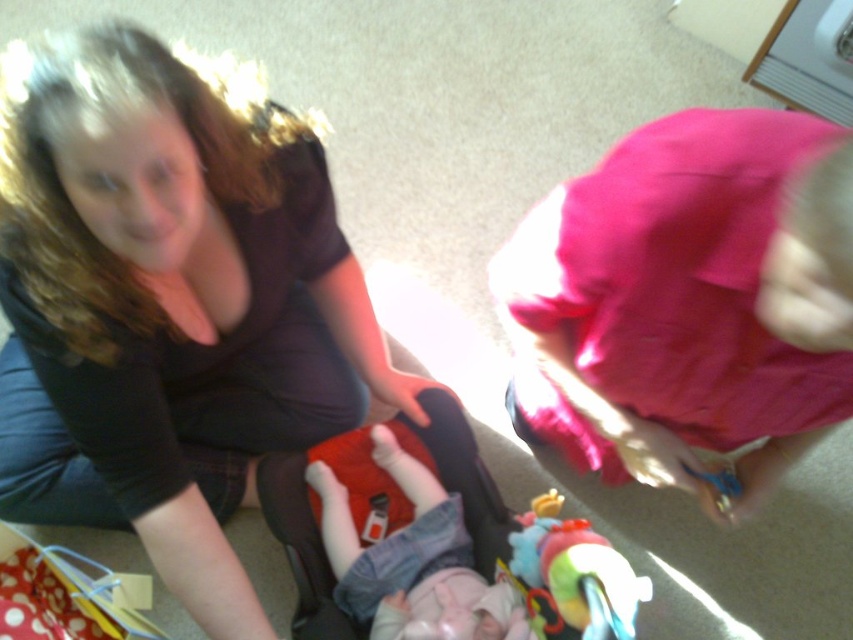
Who is more distant from viewer, (13, 492) or (587, 355)?

Point (13, 492)

Is point (318, 140) farther from camera compared to point (726, 163)?

Yes.

Does point (206, 582) come farther from viewer compared to point (704, 502)?

No, (206, 582) is in front of (704, 502).

The image size is (853, 640). I want to click on matte black shirt at center, so click(x=167, y=301).

Looking at this image, which of these two, denim pants at center or rubberized plastic toy at lower center, stands shorter?

rubberized plastic toy at lower center

In the scene shown: Can you confirm if denim pants at center is shorter than rubberized plastic toy at lower center?

In fact, denim pants at center may be taller than rubberized plastic toy at lower center.

Which is in front, point (459, 545) or point (589, 600)?

Point (589, 600) is in front.

Find the location of a particular element. denim pants at center is located at coordinates (412, 561).

Does pink fabric at upper right appear on the right side of rubberized plastic toy at lower center?

Correct, you'll find pink fabric at upper right to the right of rubberized plastic toy at lower center.

Does pink fabric at upper right have a greater width compared to rubberized plastic toy at lower center?

Yes.

Which is behind, point (740, 310) or point (558, 612)?

Point (558, 612)

Identify the location of pink fabric at upper right. This screenshot has height=640, width=853. (688, 300).